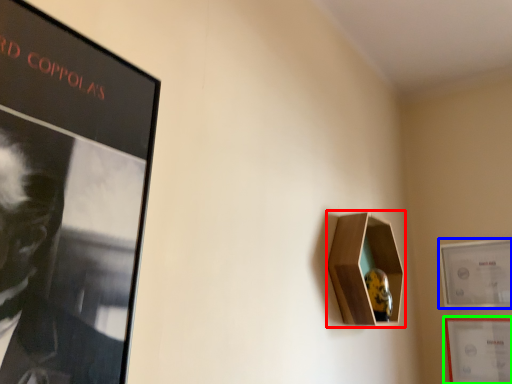
Question: Estimate the real-world distances between objects in this image. Which object is farther from cabinet (highlighted by a red box), picture frame (highlighted by a blue box) or picture frame (highlighted by a green box)?

Choices:
 (A) picture frame
 (B) picture frame

Answer: (B)